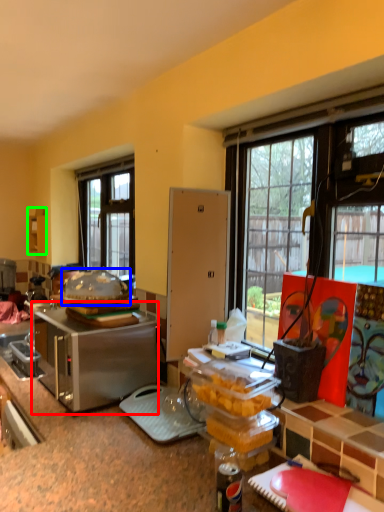
Question: Which object is positioned closest to appliance (highlighted by a red box)? Select from food (highlighted by a blue box) and cabinetry (highlighted by a green box).

Choices:
 (A) food
 (B) cabinetry

Answer: (A)